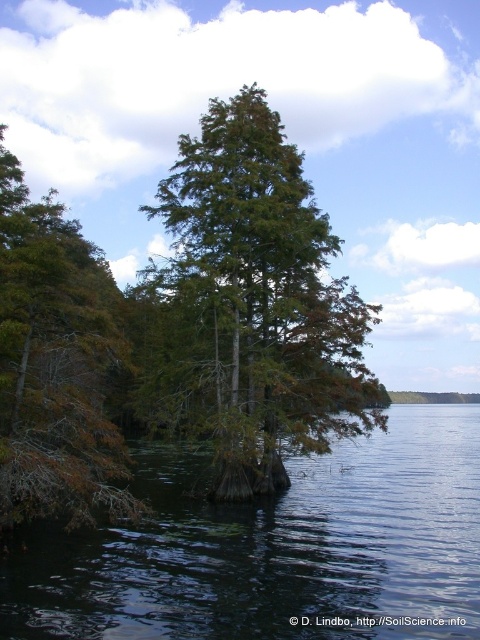
From the picture: You are standing at the edge of the water in the scene. There is a dark green water at lower left located at point (277, 548). If you want to reach the point where the dark green water at lower left is located, which direction should you move relative to your current position?

The dark green water at lower left is located at point (277, 548), so you should move towards the lower left direction to reach that point.

You are a park ranger planning to install a safety barrier between the green matte tree at center and the brown matte tree at left. The barrier requires a minimum distance of 10 meters between the trees to be effective. Based on the scene, will the barrier be effective?

The green matte tree at center is 8.73 meters away from the brown matte tree at left. Since the required distance for the barrier is 10 meters, the current distance is insufficient, so the barrier will not be effective.

In the scene shown: You are a kayaker planning to navigate between the dark green water at lower left and the green matte tree at center. The kayak requires a minimum of 10 meters of space to safely pass between obstacles. Based on the scene, can you safely navigate through this area?

The dark green water at lower left and green matte tree at center are 9.51 meters apart, which is less than the required 10 meters for safe navigation. Therefore, it is not safe to navigate through this area.